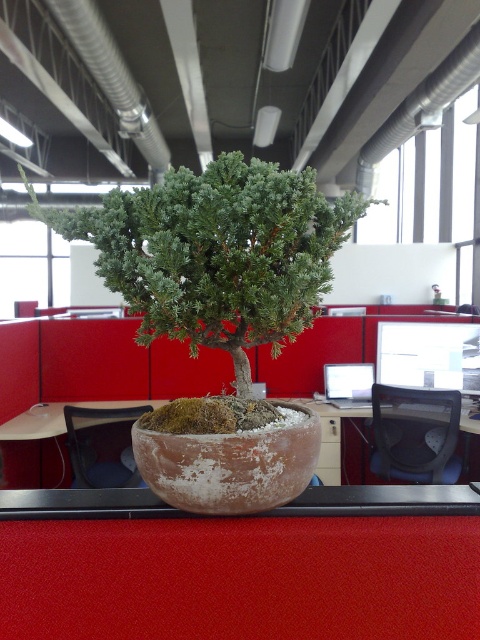
You are an office worker who wants to place a new 12 inch wide potted plant on your desk. The green textured bonsai at center is already on the desk. Can you fit the new plant next to it without moving the bonsai?

The distance between the green textured bonsai at center and the edge of the desk is 27.11 inches. Since the new plant is 12 inches wide, there is enough space to place it next to the bonsai as long as the total space required does not exceed the available 27.11 inches. However, without knowing the exact width of the bonsai itself, it is difficult to confirm definitively. If the bonsai is less than 15.055 inches wide, there would be sufficient space for both plants.

You are organizing an office space and need to move the green textured bonsai at center and the matte brown desk at center. If you want to place the bonsai behind the desk, which object should you move first?

The green textured bonsai at center is currently in front of the matte brown desk at center. To place the bonsai behind the desk, you should move the green textured bonsai at center first so that it can be positioned behind the matte brown desk at center.

You are standing in an office with red cubicle walls and want to place a small potted plant exactly at the center of the room. The center of the room is marked by a point at coordinates point (216,253). Can you confirm if the green textured bonsai at center is already placed at that exact coordinate?

The green textured bonsai at center is located at point (216,253), so yes, it is already placed at the exact coordinate specified.